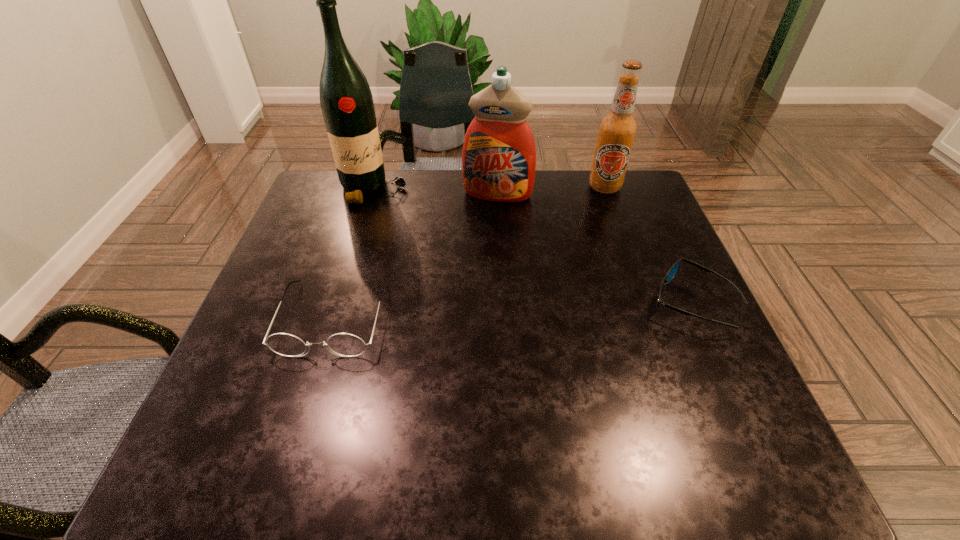
I want to click on vacant spot on the desktop that is between the spectacles and the sunglasses and is positioned on the front surface of the third object from left to right, so click(470, 312).

The width and height of the screenshot is (960, 540). Find the location of `vacant space on the desktop that is between the spectacles and the shortest object and is positioned on the surface of the wine bottle`. vacant space on the desktop that is between the spectacles and the shortest object and is positioned on the surface of the wine bottle is located at coordinates pos(464,313).

This screenshot has height=540, width=960. I want to click on free spot on the desktop that is between the fourth tallest object and the sunglasses and is positioned on the front label of the beer bottle, so click(561, 308).